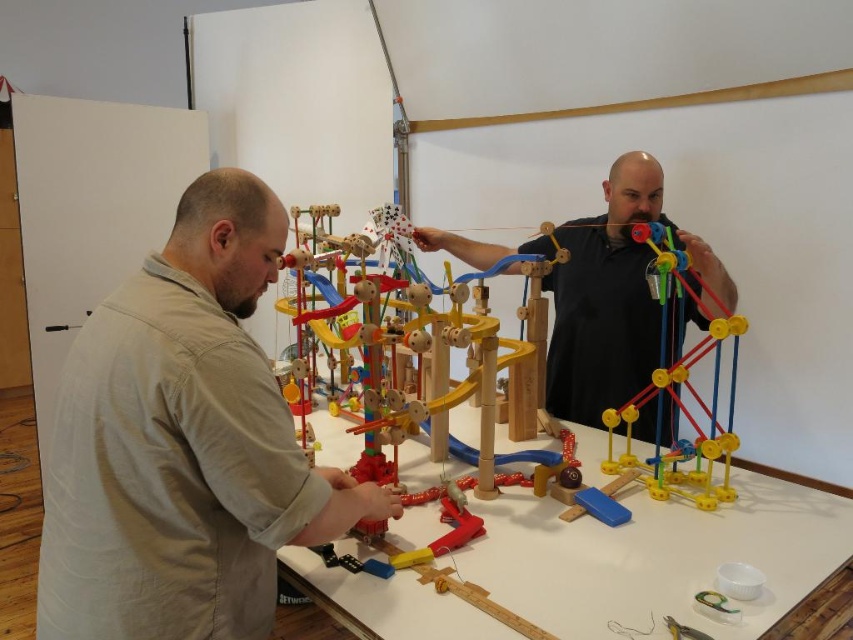
You are a delivery robot with a 16 inch wide package. You need to navigate through the space between the light beige shirt at center and the wooden at center. Can you pass through this space with your package?

The distance between the light beige shirt at center and the wooden at center is 17.84 inches. Since your package is 16 inches wide, you can pass through the space as the available width is greater than the package width.